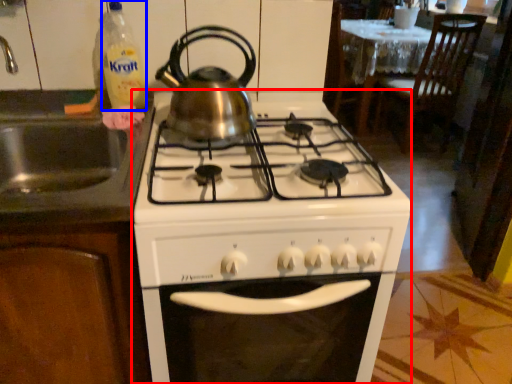
Question: Which point is closer to the camera, gas stove (highlighted by a red box) or bottle (highlighted by a blue box)?

Choices:
 (A) gas stove
 (B) bottle

Answer: (A)